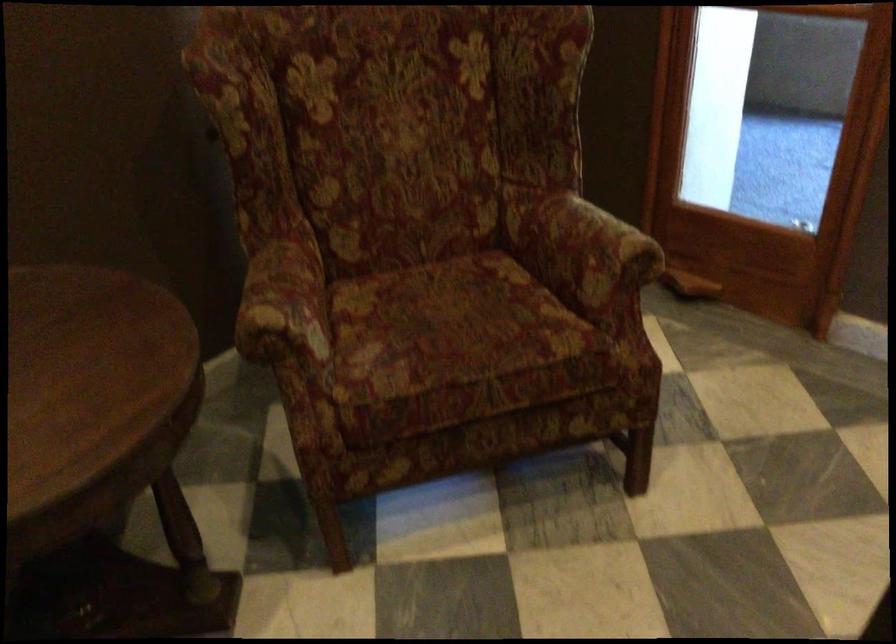
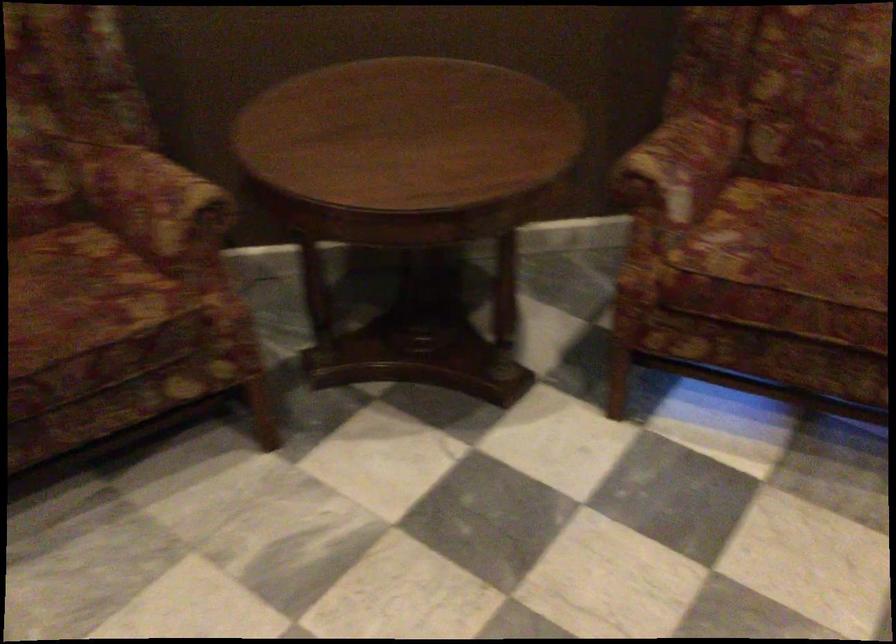
Question: The camera is either moving clockwise (left) or counter-clockwise (right) around the object. The first image is from the beginning of the video and the second image is from the end. Is the camera moving left or right when shooting the video?

Choices:
 (A) Left
 (B) Right

Answer: (B)